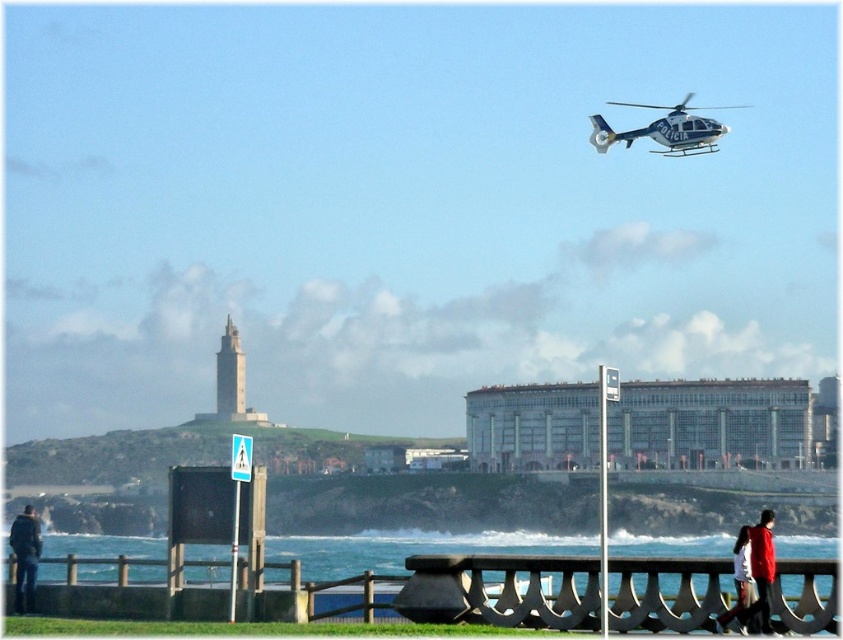
You are a photographer trying to capture both the blue metallic helicopter at upper right and the red fabric jacket at lower right in the same frame. Since the helicopter is larger, which object should you focus on first to ensure both are in the shot?

The blue metallic helicopter at upper right is bigger than the red fabric jacket at lower right. To ensure both are in the shot, focus on the blue metallic helicopter at upper right first as it takes up more space in the frame.

You are a photographer positioned at the scene wanting to capture both the red fabric jacket at lower right and the dark blue jacket at lower left in a single shot. Considering their positions relative to you, which jacket will appear larger in the photo?

The red fabric jacket at lower right will appear larger in the photo because it is closer to the viewer than the dark blue jacket at lower left.

You are a photographer planning to take a group photo of the two people wearing the red fabric jacket at lower right and dark blue jacket at lower left. Which jacket is more suitable to be placed in the center of the frame to ensure both subjects are equally visible?

The red fabric jacket at lower right is smaller than the dark blue jacket at lower left, so placing the person wearing the dark blue jacket at lower left in the center would help balance the visual weight between both subjects.